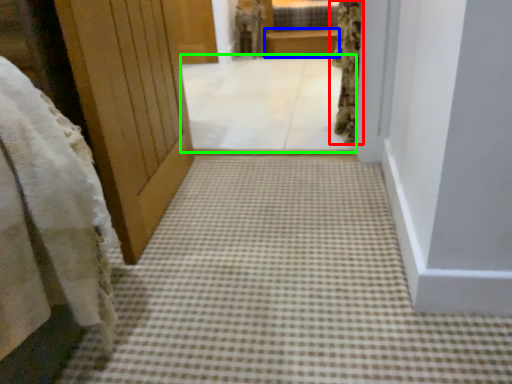
Question: Which object is the farthest from curtain (highlighted by a red box)? Choose among these: balustrade (highlighted by a blue box) or corridor (highlighted by a green box).

Choices:
 (A) balustrade
 (B) corridor

Answer: (A)